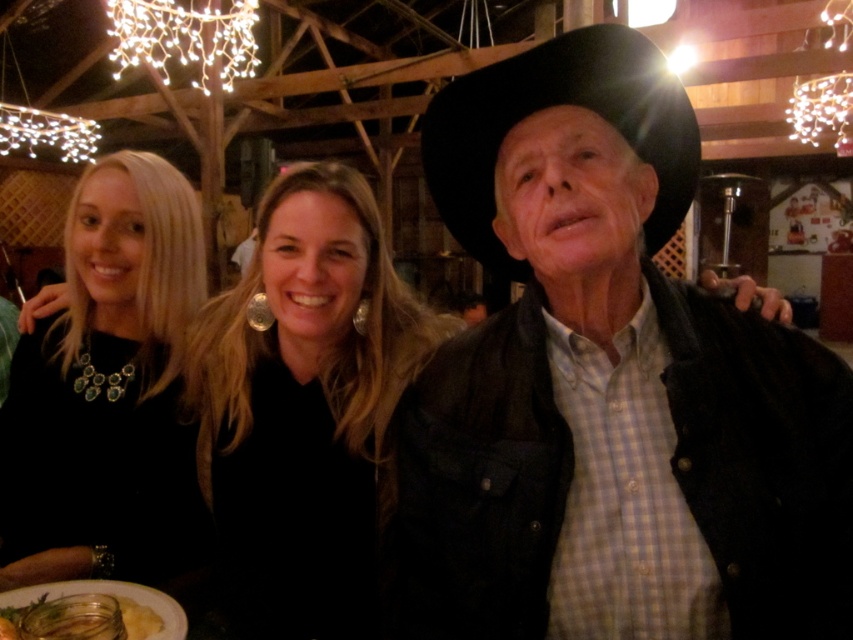
Based on the scene description, where is the black matte necklace at left located in terms of its 2D position?

The black matte necklace at left is located at the 2D coordinates point (108, 392).

You are a photographer standing at the camera position. You want to ensure the black matte necklace at left is in focus while capturing the group photo. Given that your camera has a depth of field that can sharply focus objects within 3 feet, will the necklace be in focus?

The black matte necklace at left is 3.72 feet away from the camera. Since the depth of field can only sharply focus objects within 3 feet, the necklace will be slightly out of focus.